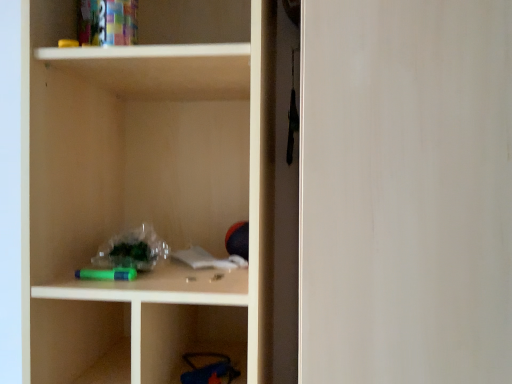
Question: From a real-world perspective, is matte wood cabinet at center positioned above or below transparent glass door at right?

Choices:
 (A) below
 (B) above

Answer: (B)

Question: Is matte wood cabinet at center in front of or behind transparent glass door at right in the image?

Choices:
 (A) behind
 (B) front

Answer: (A)

Question: From the image's perspective, relative to transparent glass door at right, is matte wood cabinet at center above or below?

Choices:
 (A) above
 (B) below

Answer: (A)

Question: From the image's perspective, is transparent glass door at right positioned above or below matte wood cabinet at center?

Choices:
 (A) below
 (B) above

Answer: (A)

Question: Looking at their shapes, would you say transparent glass door at right is wider or thinner than matte wood cabinet at center?

Choices:
 (A) thin
 (B) wide

Answer: (B)

Question: In terms of size, does transparent glass door at right appear bigger or smaller than matte wood cabinet at center?

Choices:
 (A) small
 (B) big

Answer: (B)

Question: Considering their positions, is transparent glass door at right located in front of or behind matte wood cabinet at center?

Choices:
 (A) front
 (B) behind

Answer: (A)